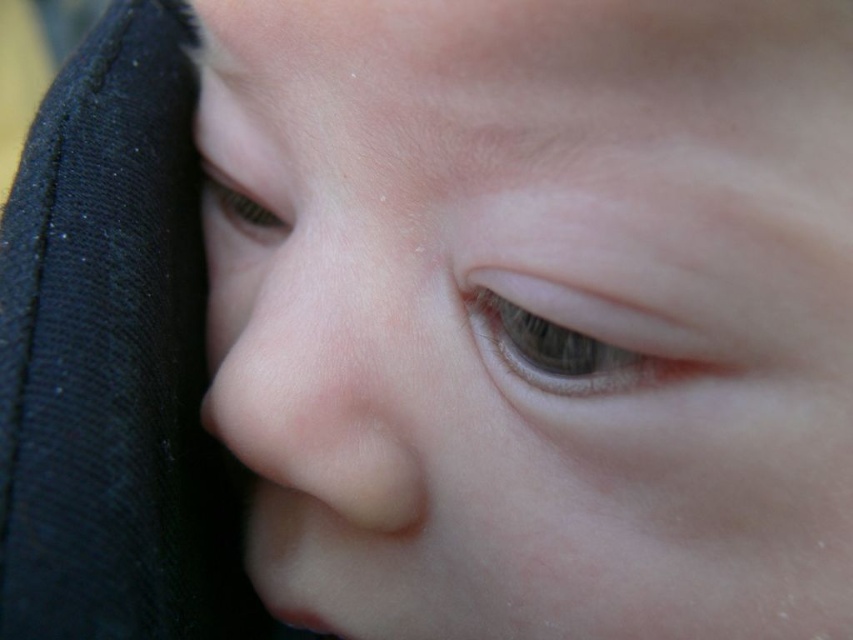
You are a photographer adjusting the focus on a camera to capture a closeup of a baby. You notice the smooth skin nose at center and the matte skin eye at upper left. Given that the camera can only focus on one object at a time, which object should you focus on to ensure the closest object is in sharp detail?

The smooth skin nose at center is closer to the camera than the matte skin eye at upper left, so focusing on the smooth skin nose at center will ensure the closest object is in sharp detail.

Looking at the baby in the image, which object has a smaller height between the brown matte eye at center and the matte skin eye at upper left?

The brown matte eye at center has a smaller height compared to the matte skin eye at upper left.